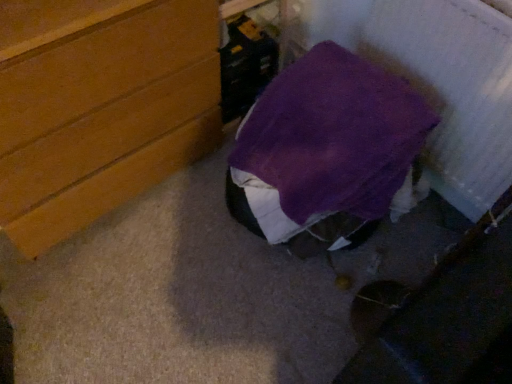
Question: Does purple fabric bag at center turn towards wooden chest of drawers at left?

Choices:
 (A) no
 (B) yes

Answer: (A)

Question: Is purple fabric bag at center looking in the opposite direction of wooden chest of drawers at left?

Choices:
 (A) no
 (B) yes

Answer: (A)

Question: From a real-world perspective, is purple fabric bag at center on top of wooden chest of drawers at left?

Choices:
 (A) no
 (B) yes

Answer: (A)

Question: Can you confirm if purple fabric bag at center is thinner than wooden chest of drawers at left?

Choices:
 (A) yes
 (B) no

Answer: (B)

Question: Considering the relative sizes of purple fabric bag at center and wooden chest of drawers at left in the image provided, is purple fabric bag at center taller than wooden chest of drawers at left?

Choices:
 (A) no
 (B) yes

Answer: (A)

Question: From the image's perspective, does purple fabric bag at center appear lower than wooden chest of drawers at left?

Choices:
 (A) no
 (B) yes

Answer: (B)

Question: Is wooden chest of drawers at left closer to camera compared to purple fabric bag at center?

Choices:
 (A) no
 (B) yes

Answer: (B)

Question: Considering the relative positions of wooden chest of drawers at left and purple fabric bag at center in the image provided, is wooden chest of drawers at left behind purple fabric bag at center?

Choices:
 (A) no
 (B) yes

Answer: (A)

Question: Is wooden chest of drawers at left to the left of purple fabric bag at center from the viewer's perspective?

Choices:
 (A) yes
 (B) no

Answer: (A)

Question: Does wooden chest of drawers at left have a larger size compared to purple fabric bag at center?

Choices:
 (A) yes
 (B) no

Answer: (A)

Question: Is wooden chest of drawers at left oriented towards purple fabric bag at center?

Choices:
 (A) yes
 (B) no

Answer: (A)

Question: From a real-world perspective, is wooden chest of drawers at left on purple fabric bag at center?

Choices:
 (A) yes
 (B) no

Answer: (A)

Question: Would you say purple fabric bag at center is to the left or to the right of wooden chest of drawers at left in the picture?

Choices:
 (A) right
 (B) left

Answer: (A)